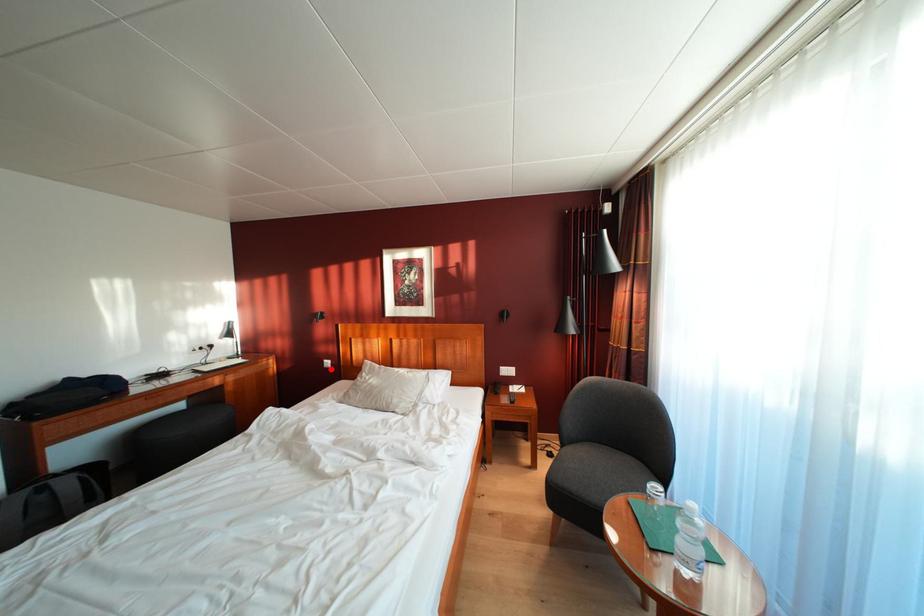
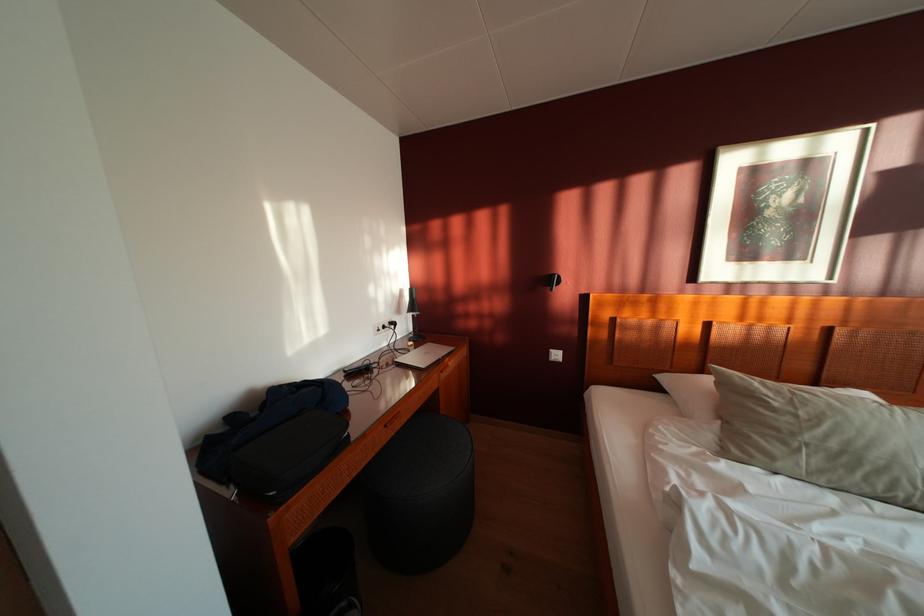
In the second image, find the point that corresponds to the highlighted location in the first image.

(555, 360)